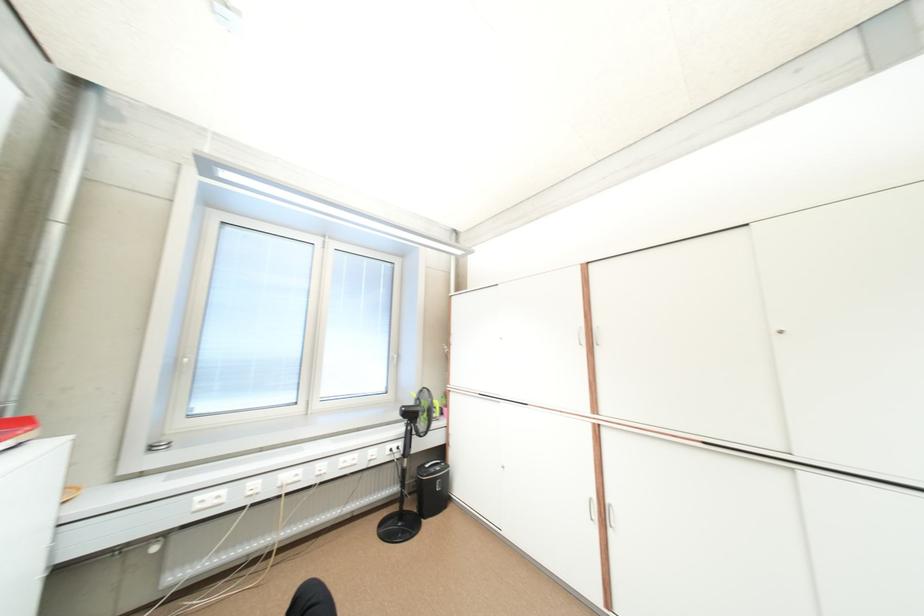
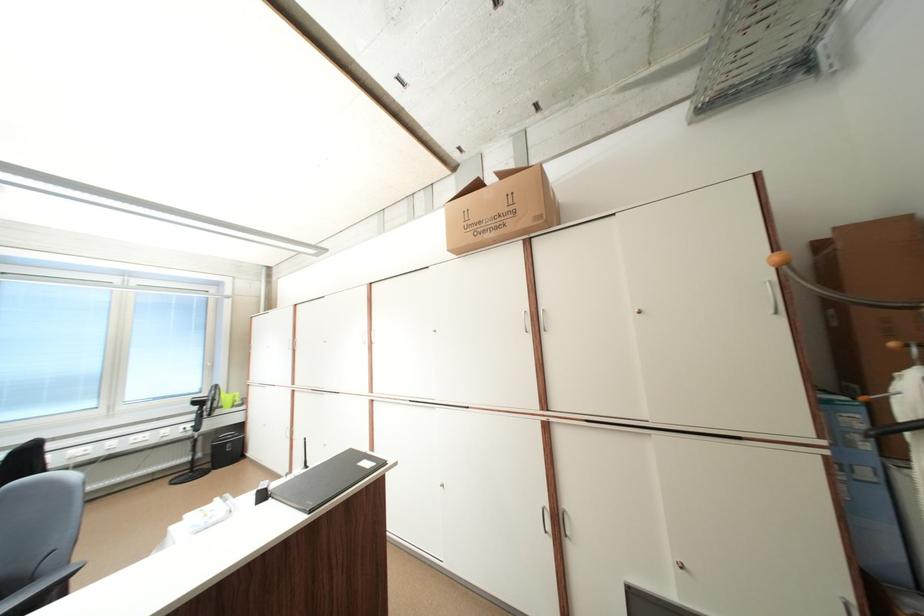
In the scene shown: Which direction would the cameraman need to move to produce the second image?

The movement direction of the cameraman is right, backward.